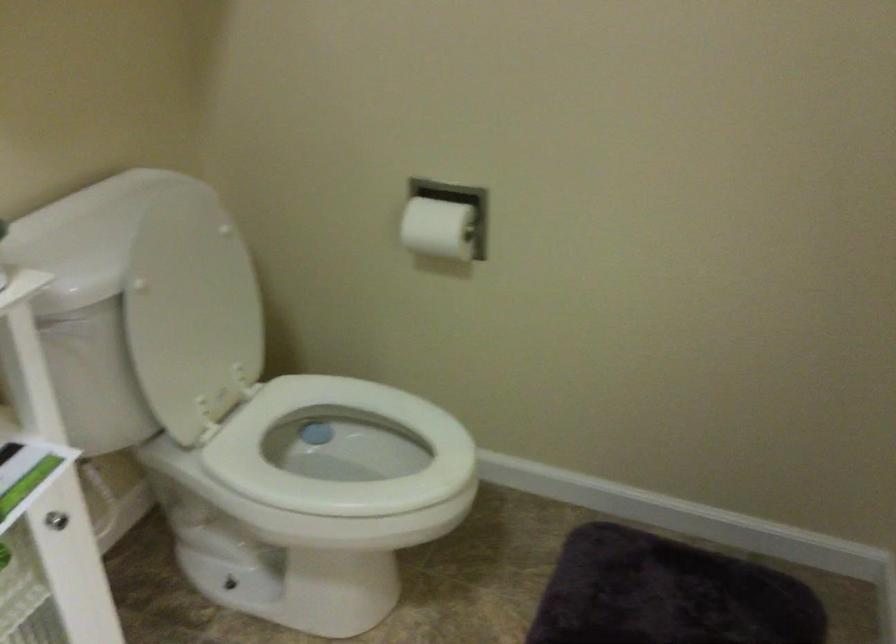
What do you see at coordinates (345, 451) in the screenshot? The width and height of the screenshot is (896, 644). I see `the white toilet seat` at bounding box center [345, 451].